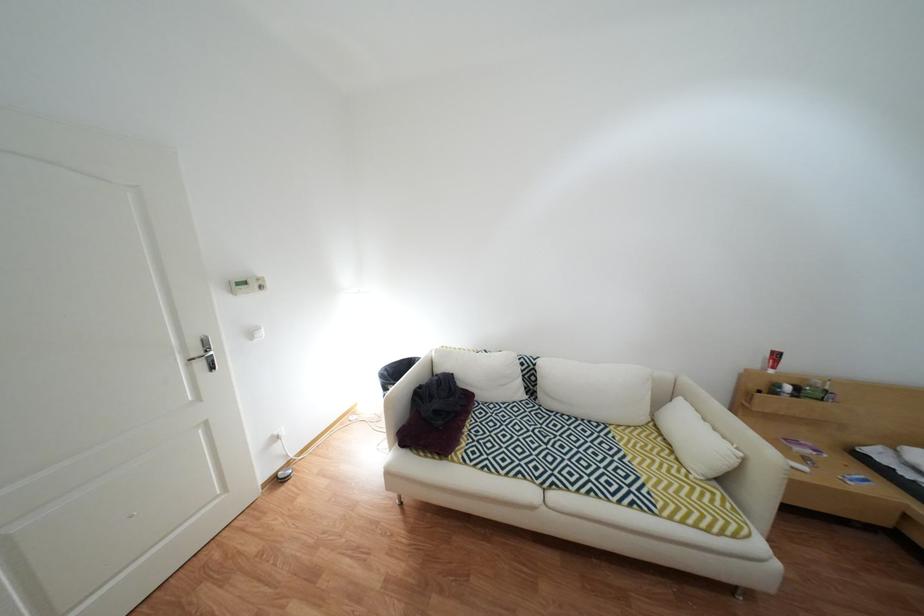
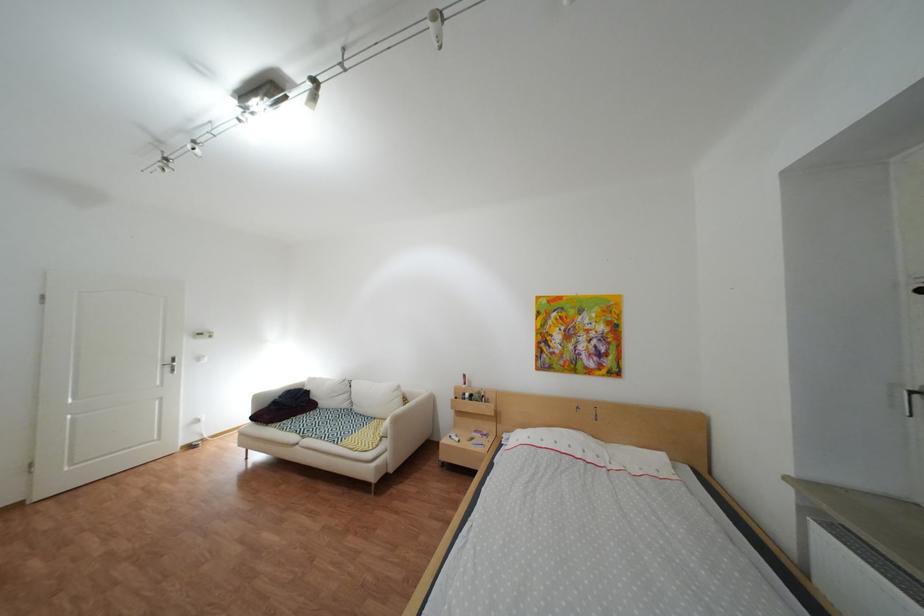
The images are taken continuously from a first-person perspective. In which direction are you moving?

The movement direction of the cameraman is right, backward.